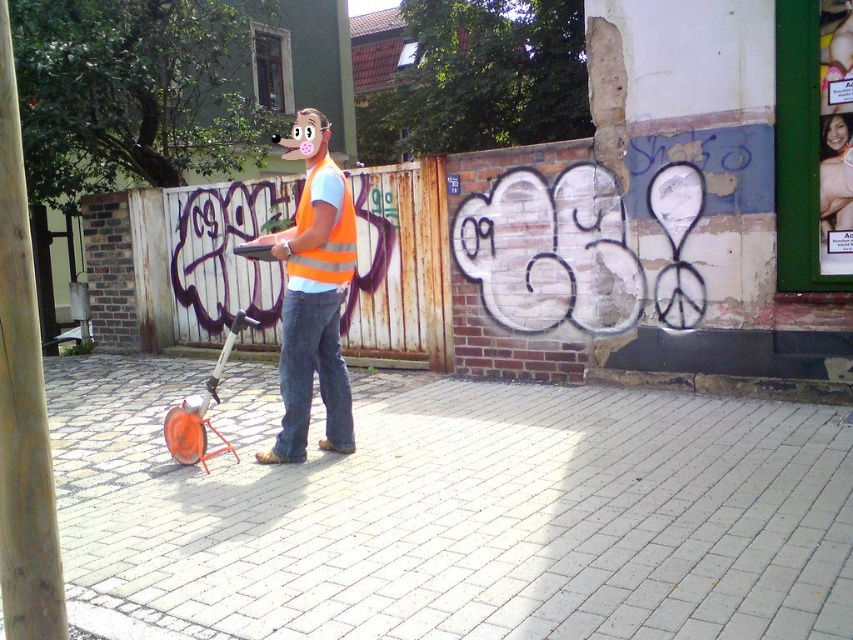
You are standing in the urban scene and want to determine which of the two points, point (22, 330) or point (350, 237), is nearer to you. Based on the scene description, which point is closer?

Point (22, 330) is closer to the viewer than point (350, 237).